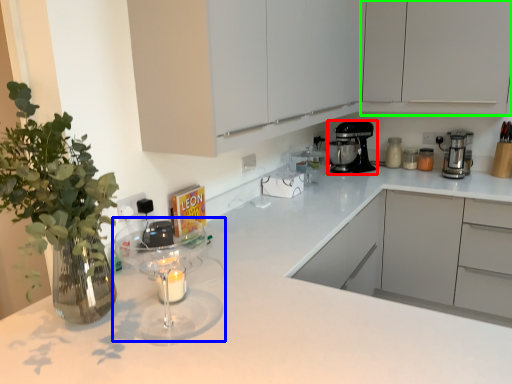
Question: Estimate the real-world distances between objects in this image. Which object is farther from kitchen appliance (highlighted by a red box), mixer (highlighted by a blue box) or cabinetry (highlighted by a green box)?

Choices:
 (A) mixer
 (B) cabinetry

Answer: (A)